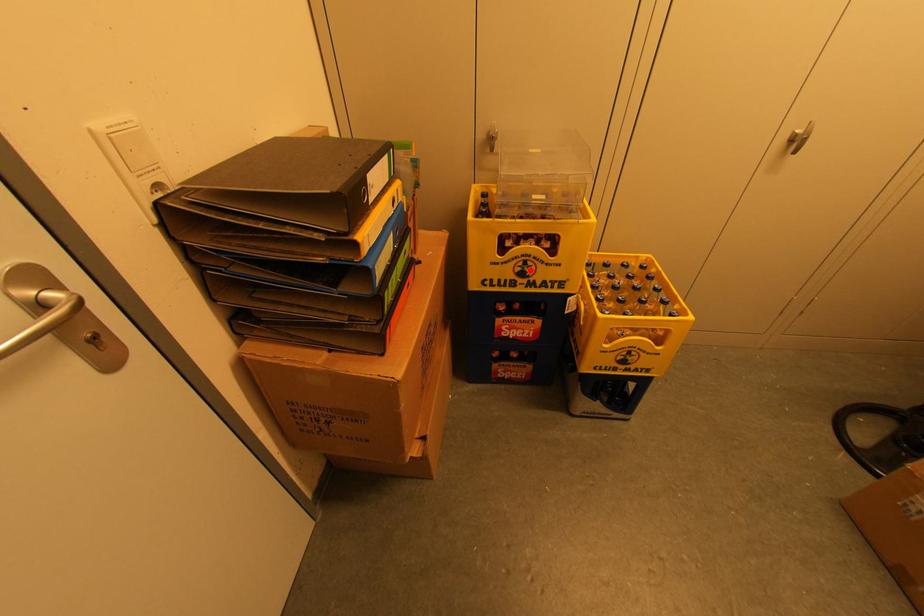
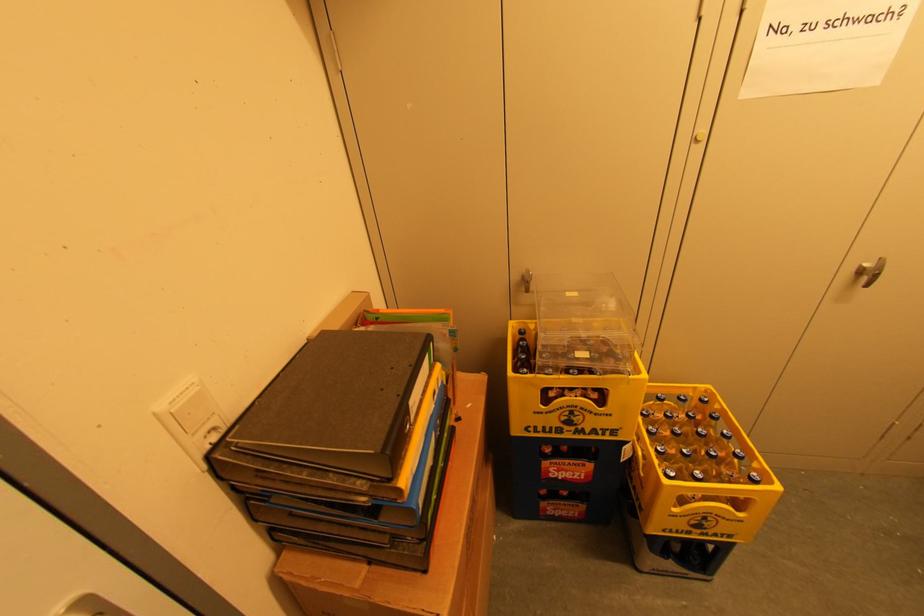
Question: A red point is marked in image1. In image2, is the corresponding 3D point closer to the camera or farther? Reply with the corresponding letter.

Choices:
 (A) The corresponding 3D point is closer.
 (B) The corresponding 3D point is farther.

Answer: (B)